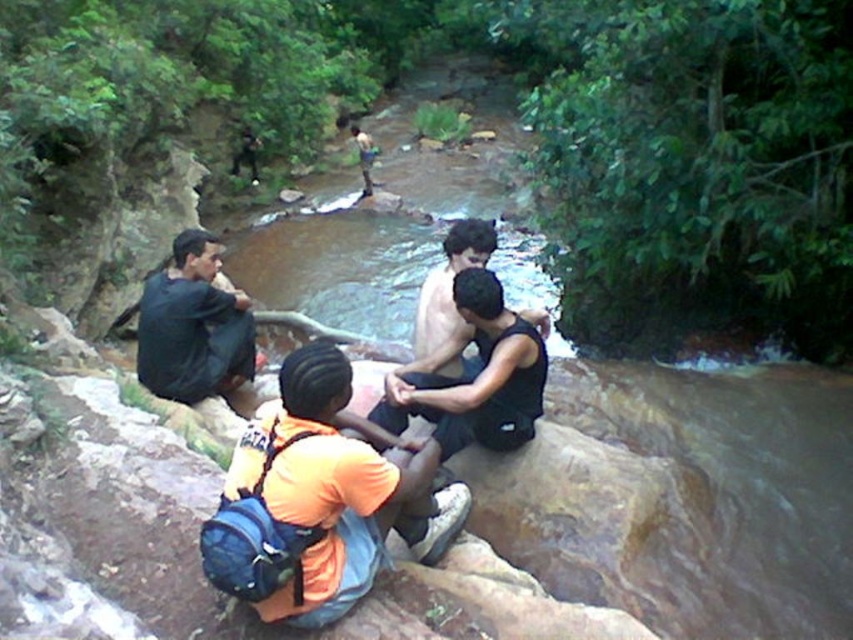
You are standing at the point with coordinates (x=321, y=499) in the image. What object are you standing on?

You are standing on the orange fabric backpack at center.

You are a photographer trying to capture a candid shot of the orange fabric backpack at center and the shiny black tank top at center. Since you want to ensure both are clearly visible, which object should you focus on first to account for their sizes?

The orange fabric backpack at center is taller than the shiny black tank top at center, so you should focus on the orange fabric backpack at center first to ensure its details are captured clearly before adjusting for the smaller shiny black tank top at center.